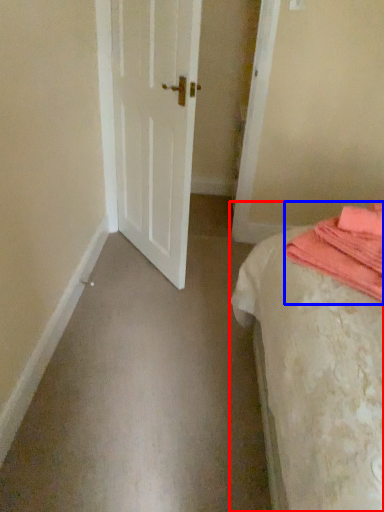
Question: Which object is closer to the camera taking this photo, bed (highlighted by a red box) or blanket (highlighted by a blue box)?

Choices:
 (A) bed
 (B) blanket

Answer: (A)